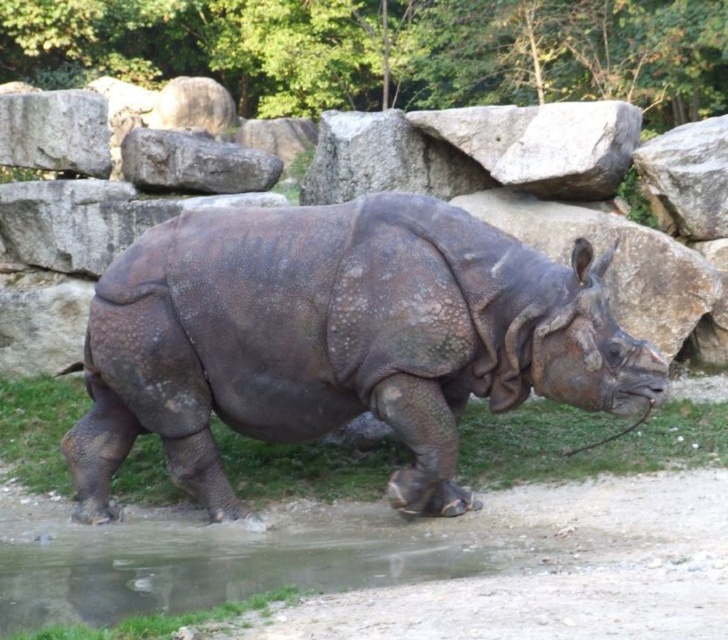
You are standing in a wildlife sanctuary and see the dark brown textured rhinoceros at center. If you want to observe it from a safe distance of 20 feet, should you move closer or farther away?

The dark brown textured rhinoceros at center is currently 21.64 feet away from you. Since the safe distance is 20 feet, you need to move closer to reach the safe distance.

You are a zookeeper observing the dark brown textured rhinoceros at center and the transparent wet ground at lower center in the enclosure. Which object is wider?

The dark brown textured rhinoceros at center is wider than the transparent wet ground at lower center.

Looking at this image, you are a zookeeper observing the rhinoceros in its enclosure. You need to determine if the transparent wet ground at lower center is under the dark brown textured rhinoceros at center. Based on the scene description, can you confirm this?

The dark brown textured rhinoceros at center is taller than transparent wet ground at lower center, so yes, the transparent wet ground at lower center is under the dark brown textured rhinoceros at center.